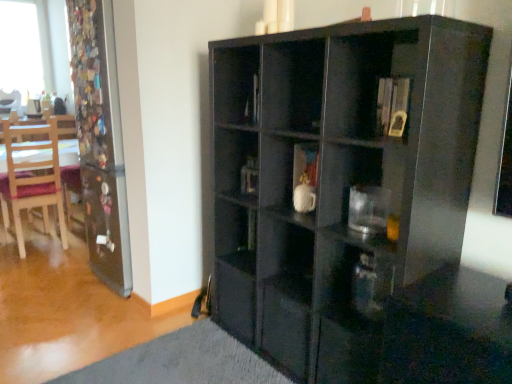
The height and width of the screenshot is (384, 512). I want to click on transparent glass screen door at left, so [x=100, y=141].

Image resolution: width=512 pixels, height=384 pixels. Identify the location of transparent glass coffee cup at center-right. coord(368,209).

What is the approximate height of glossy black cabinet at center?

The height of glossy black cabinet at center is 1.47 meters.

Locate an element on the screen. This screenshot has height=384, width=512. wooden chair at left, the 1th chair positioned from the right is located at coordinates (32, 180).

From the picture: Choose the correct answer: Is glossy black cabinet at center inside wooden chair at left, the 1th chair positioned from the right, or outside it?

glossy black cabinet at center lies outside wooden chair at left, the 1th chair positioned from the right.

In terms of size, does glossy black cabinet at center appear bigger or smaller than wooden chair at left, the second chair from the top?

In the image, glossy black cabinet at center appears to be larger than wooden chair at left, the second chair from the top.

Which object is further away from the camera taking this photo, glossy black cabinet at center or wooden chair at left, arranged as the second chair when viewed from the back?

wooden chair at left, arranged as the second chair when viewed from the back, is further from the camera.

Measure the distance between glossy black cabinet at center and wooden chair at left, the 1th chair positioned from the right.

glossy black cabinet at center is 7.78 feet from wooden chair at left, the 1th chair positioned from the right.

Is transparent glass screen door at left looking in the opposite direction of transparent glass window at upper left?

That's not correct — transparent glass screen door at left is not looking away from transparent glass window at upper left.

Considering the relative positions of transparent glass screen door at left and transparent glass window at upper left in the image provided, is transparent glass screen door at left in front of transparent glass window at upper left?

Yes, transparent glass screen door at left is closer to the camera.

Is transparent glass screen door at left placed right next to transparent glass window at upper left?

No, transparent glass screen door at left is not touching transparent glass window at upper left.

Would you say glossy black cabinet at center is to the left or to the right of transparent glass coffee cup at center-right in the picture?

glossy black cabinet at center is to the left of transparent glass coffee cup at center-right.

Does glossy black cabinet at center have a greater height compared to transparent glass coffee cup at center-right?

Yes, glossy black cabinet at center is taller than transparent glass coffee cup at center-right.

Is glossy black cabinet at center spatially inside transparent glass coffee cup at center-right, or outside of it?

glossy black cabinet at center cannot be found inside transparent glass coffee cup at center-right.

Does glossy black cabinet at center have a larger size compared to transparent glass coffee cup at center-right?

Correct, glossy black cabinet at center is larger in size than transparent glass coffee cup at center-right.

Considering the points (108, 95) and (20, 131), which point is in front, point (108, 95) or point (20, 131)?

Point (108, 95)

From the image's perspective, is transparent glass screen door at left above wooden chair at left, the 1th chair positioned from the right?

Indeed, from the image's perspective, transparent glass screen door at left is shown above wooden chair at left, the 1th chair positioned from the right.

Visually, is transparent glass screen door at left positioned to the left or to the right of wooden chair at left, which is the second chair in left-to-right order?

In the image, transparent glass screen door at left appears on the right side of wooden chair at left, which is the second chair in left-to-right order.

How much distance is there between transparent glass screen door at left and wooden chair at left, which is the second chair in left-to-right order?

A distance of 3.29 feet exists between transparent glass screen door at left and wooden chair at left, which is the second chair in left-to-right order.

Is transparent glass coffee cup at center-right facing towards transparent glass screen door at left?

No, transparent glass coffee cup at center-right is not oriented towards transparent glass screen door at left.

Would you say transparent glass coffee cup at center-right is inside or outside transparent glass screen door at left?

transparent glass coffee cup at center-right exists outside the volume of transparent glass screen door at left.

In terms of height, does transparent glass coffee cup at center-right look taller or shorter compared to transparent glass screen door at left?

transparent glass coffee cup at center-right is shorter than transparent glass screen door at left.

Which object is closer to the camera taking this photo, transparent glass coffee cup at center-right or transparent glass screen door at left?

transparent glass coffee cup at center-right is in front.

From the image's perspective, is transparent glass window at upper left below wooden chair at left, the second chair viewed from the front?

No, from the image's perspective, transparent glass window at upper left is not below wooden chair at left, the second chair viewed from the front.

How distant is transparent glass window at upper left from wooden chair at left, the 1th chair positioned from the back?

transparent glass window at upper left and wooden chair at left, the 1th chair positioned from the back, are 25.48 inches apart from each other.

Does transparent glass window at upper left have a smaller size compared to wooden chair at left, which ranks as the 1th chair in top-to-bottom order?

Incorrect, transparent glass window at upper left is not smaller in size than wooden chair at left, which ranks as the 1th chair in top-to-bottom order.

Is transparent glass window at upper left in front of wooden chair at left, the 1th chair positioned from the back?

No, the depth of transparent glass window at upper left is greater than that of wooden chair at left, the 1th chair positioned from the back.

This screenshot has width=512, height=384. I want to click on cabinetry lying on the right of wooden chair at left, which is the second chair in left-to-right order, so click(348, 201).

Can you confirm if wooden chair at left, marked as the first chair in a front-to-back arrangement, is positioned to the right of glossy black cabinet at center?

In fact, wooden chair at left, marked as the first chair in a front-to-back arrangement, is to the left of glossy black cabinet at center.

Is glossy black cabinet at center completely or partially inside wooden chair at left, arranged as the second chair when viewed from the back?

No, glossy black cabinet at center is not surrounded by wooden chair at left, arranged as the second chair when viewed from the back.

From the image's perspective, which one is positioned lower, wooden chair at left, marked as the first chair in a front-to-back arrangement, or glossy black cabinet at center?

From the image's view, glossy black cabinet at center is below.

Identify the location of cabinetry in front of the wooden chair at left, the second chair from the top. The image size is (512, 384). (348, 201).

The height and width of the screenshot is (384, 512). I want to click on window behind the transparent glass screen door at left, so click(25, 48).

Considering their positions, is transparent glass screen door at left positioned closer to wooden chair at left, arranged as the second chair when viewed from the back, than glossy black cabinet at center?

transparent glass screen door at left lies closer to wooden chair at left, arranged as the second chair when viewed from the back, than the other object.

Which object lies nearer to the anchor point transparent glass window at upper left, wooden chair at left, the 1th chair positioned from the right, or transparent glass coffee cup at center-right?

wooden chair at left, the 1th chair positioned from the right, lies closer to transparent glass window at upper left than the other object.

Based on their spatial positions, is glossy black cabinet at center or wooden chair at left, the second chair from the right, closer to wooden chair at left, the second chair from the top?

The object closer to wooden chair at left, the second chair from the top, is wooden chair at left, the second chair from the right.

Considering their positions, is wooden chair at left, the 1th chair positioned from the right, positioned closer to wooden chair at left, the 1th chair viewed from the left, than glossy black cabinet at center?

Based on the image, wooden chair at left, the 1th chair positioned from the right, appears to be nearer to wooden chair at left, the 1th chair viewed from the left.

Based on their spatial positions, is transparent glass coffee cup at center-right or transparent glass screen door at left further from wooden chair at left, the 1th chair viewed from the left?

Based on the image, transparent glass coffee cup at center-right appears to be further to wooden chair at left, the 1th chair viewed from the left.

Estimate the real-world distances between objects in this image. Which object is further from glossy black cabinet at center, transparent glass screen door at left or transparent glass window at upper left?

Among the two, transparent glass window at upper left is located further to glossy black cabinet at center.

From the image, which object appears to be nearer to wooden chair at left, the second chair from the right, transparent glass window at upper left or transparent glass screen door at left?

transparent glass window at upper left.

Estimate the real-world distances between objects in this image. Which object is further from wooden chair at left, the second chair from the right, glossy black cabinet at center or transparent glass coffee cup at center-right?

transparent glass coffee cup at center-right is positioned further to the anchor wooden chair at left, the second chair from the right.

Find the location of a particular element. screen door located between glossy black cabinet at center and wooden chair at left, the second chair from the right, in the depth direction is located at coordinates click(100, 141).

Where is `cabinetry between transparent glass screen door at left and transparent glass coffee cup at center-right in the horizontal direction`? cabinetry between transparent glass screen door at left and transparent glass coffee cup at center-right in the horizontal direction is located at coordinates (348, 201).

The height and width of the screenshot is (384, 512). In order to click on screen door between wooden chair at left, the second chair viewed from the front, and transparent glass coffee cup at center-right, in the horizontal direction in this screenshot , I will do `click(100, 141)`.

Identify the location of screen door between wooden chair at left, the 1th chair from the bottom, and transparent glass coffee cup at center-right from left to right. The height and width of the screenshot is (384, 512). (100, 141).